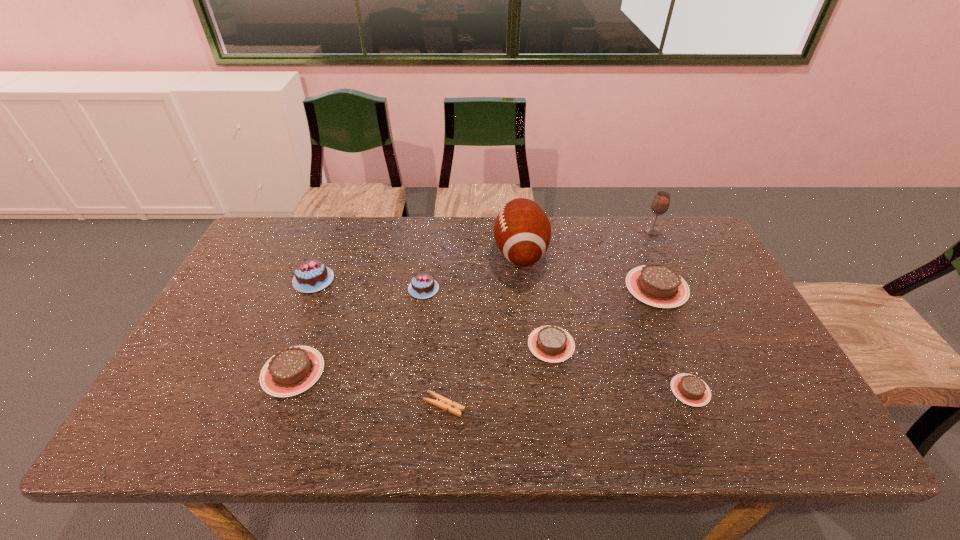
I want to click on chocolate cake that is at the right edge, so click(658, 285).

Image resolution: width=960 pixels, height=540 pixels. What are the coordinates of `object that is at the far right corner` in the screenshot? It's located at (660, 204).

Identify the location of free space at the far edge. (389, 215).

Find the location of a particular element. This screenshot has height=540, width=960. vacant area at the near edge is located at coordinates (399, 440).

What are the coordinates of `vacant space at the left edge` in the screenshot? It's located at (253, 303).

The image size is (960, 540). In order to click on vacant space at the far right corner of the desktop in this screenshot , I will do `click(685, 253)`.

Image resolution: width=960 pixels, height=540 pixels. In order to click on free space between the fourth shortest object and the biggest brown chocolate cake in this screenshot , I will do click(475, 329).

In order to click on empty location between the farthest brown chocolate cake and the right pink chocolate cake in this screenshot , I will do `click(540, 288)`.

Image resolution: width=960 pixels, height=540 pixels. What are the coordinates of `free space between the shortest object and the eighth tallest object` in the screenshot? It's located at (567, 397).

At what (x,y) coordinates should I click in order to perform the action: click on vacant point located between the second shortest object and the glass drink container. Please return your answer as a coordinate pair (x, y). Image resolution: width=960 pixels, height=540 pixels. Looking at the image, I should click on (671, 310).